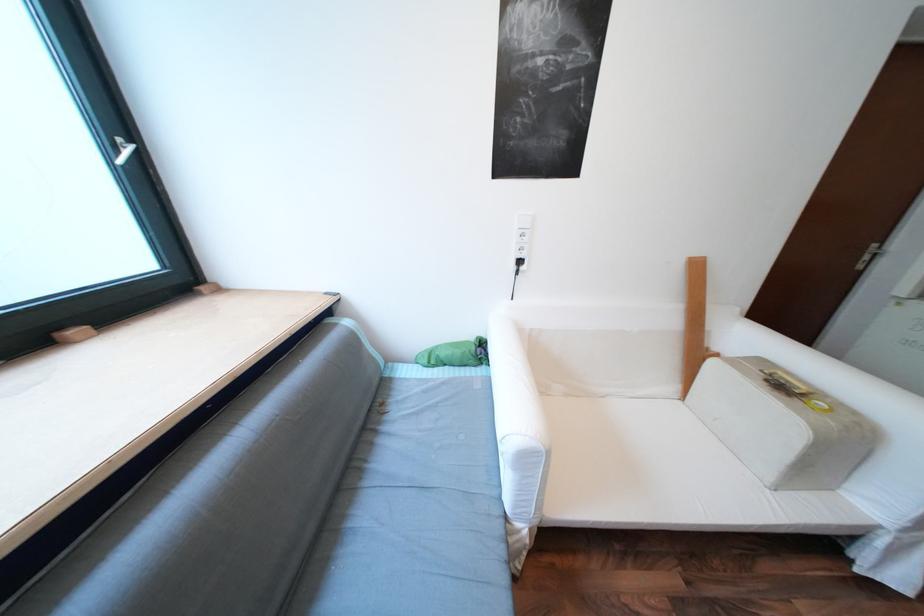
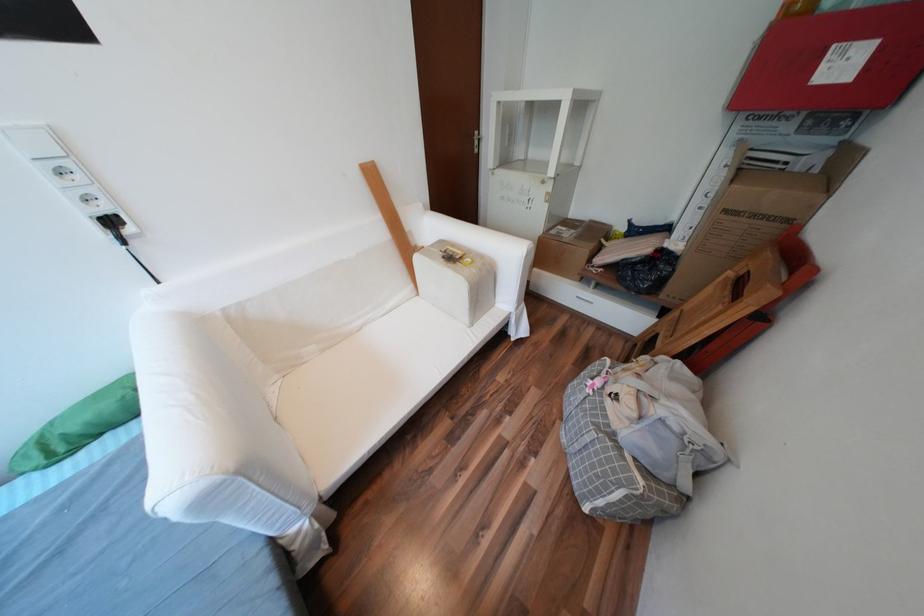
The point at (890, 527) is marked in the first image. Where is the corresponding point in the second image?

(519, 313)